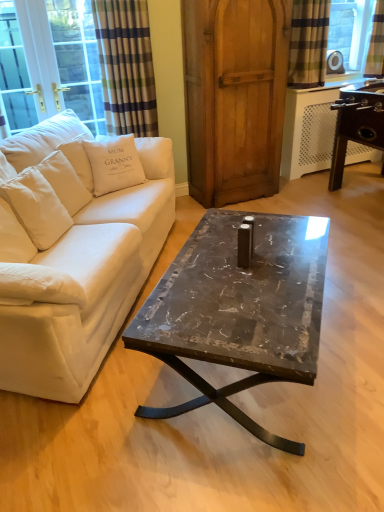
Describe the element at coordinates (74, 258) in the screenshot. I see `white fabric couch at left` at that location.

Describe the element at coordinates (126, 66) in the screenshot. I see `plaid fabric curtain at upper left, the third curtain positioned from the right` at that location.

Identify the location of white fabric cushion at left. (49, 63).

From a real-world perspective, is plaid fabric curtain at upper right, positioned as the first curtain in right-to-left order, positioned above or below wooden armoire at center?

plaid fabric curtain at upper right, positioned as the first curtain in right-to-left order, is situated higher than wooden armoire at center in the real world.

Measure the distance from plaid fabric curtain at upper right, positioned as the first curtain in right-to-left order, to wooden armoire at center.

A distance of 5.06 feet exists between plaid fabric curtain at upper right, positioned as the first curtain in right-to-left order, and wooden armoire at center.

From the image's perspective, is plaid fabric curtain at upper right, positioned as the first curtain in right-to-left order, located above wooden armoire at center?

Yes.

Which is less distant, (378, 71) or (222, 94)?

Point (378, 71) is positioned farther from the camera compared to point (222, 94).

Is white cotton pillow at upper left surrounding wooden armoire at center?

Actually, wooden armoire at center is outside white cotton pillow at upper left.

Looking at this image, based on their sizes in the image, would you say white cotton pillow at upper left is bigger or smaller than wooden armoire at center?

white cotton pillow at upper left is smaller than wooden armoire at center.

Considering the sizes of white cotton pillow at upper left and wooden armoire at center in the image, is white cotton pillow at upper left taller or shorter than wooden armoire at center?

white cotton pillow at upper left is shorter than wooden armoire at center.

Is plaid fabric curtain at upper right, which is the 3th curtain in left-to-right order, oriented towards plaid fabric curtain at upper right, which is the 2th curtain in left-to-right order?

No.

Considering the positions of point (380, 28) and point (298, 24), is point (380, 28) closer or farther from the camera than point (298, 24)?

Point (380, 28) is farther from the camera than point (298, 24).

From the image's perspective, between plaid fabric curtain at upper right, which is the 3th curtain in left-to-right order, and plaid fabric curtain at upper right, which is the 2th curtain in left-to-right order, which one is located above?

plaid fabric curtain at upper right, which is the 3th curtain in left-to-right order, from the image's perspective.

Considering the relative sizes of plaid fabric curtain at upper right, positioned as the first curtain in right-to-left order, and plaid fabric curtain at upper right, marked as the 2th curtain in a right-to-left arrangement, in the image provided, is plaid fabric curtain at upper right, positioned as the first curtain in right-to-left order, thinner than plaid fabric curtain at upper right, marked as the 2th curtain in a right-to-left arrangement,?

Correct, the width of plaid fabric curtain at upper right, positioned as the first curtain in right-to-left order, is less than that of plaid fabric curtain at upper right, marked as the 2th curtain in a right-to-left arrangement.

Measure the distance between plaid fabric curtain at upper right, which is the 3th curtain in left-to-right order, and marble-coated coffee table at center.

A: A distance of 3.07 meters exists between plaid fabric curtain at upper right, which is the 3th curtain in left-to-right order, and marble-coated coffee table at center.

Which is more to the left, plaid fabric curtain at upper right, positioned as the first curtain in right-to-left order, or marble-coated coffee table at center?

Positioned to the left is marble-coated coffee table at center.

Locate an element on the screen. the 3rd curtain above when counting from the marble-coated coffee table at center (from the image's perspective) is located at coordinates (376, 42).

Is marble-coated coffee table at center positioned far away from plaid fabric curtain at upper right, marked as the 2th curtain in a right-to-left arrangement?

Yes.

From a real-world perspective, between marble-coated coffee table at center and plaid fabric curtain at upper right, which is the 2th curtain in left-to-right order, who is vertically lower?

marble-coated coffee table at center is physically lower.

Considering the points (266, 292) and (303, 48), which point is in front, point (266, 292) or point (303, 48)?

The point (266, 292) is in front.

Is plaid fabric curtain at upper right, which is the 2th curtain in left-to-right order, at the back of marble-coated coffee table at center?

marble-coated coffee table at center does not have its back to plaid fabric curtain at upper right, which is the 2th curtain in left-to-right order.

Would you say white fabric couch at left is outside white fabric cushion at left?

Indeed, white fabric couch at left is completely outside white fabric cushion at left.

Locate an element on the screen. Image resolution: width=384 pixels, height=512 pixels. studio couch that is on the right side of white fabric cushion at left is located at coordinates (74, 258).

Is white fabric couch at left facing towards white fabric cushion at left?

No, white fabric couch at left is not facing towards white fabric cushion at left.

Considering the sizes of white fabric couch at left and white fabric cushion at left in the image, is white fabric couch at left bigger or smaller than white fabric cushion at left?

Clearly, white fabric couch at left is larger in size than white fabric cushion at left.

From a real-world perspective, who is located lower, white fabric cushion at left or plaid fabric curtain at upper right, which is the 2th curtain in left-to-right order?

Answer: white fabric cushion at left is physically lower.

How different are the orientations of white fabric cushion at left and plaid fabric curtain at upper right, marked as the 2th curtain in a right-to-left arrangement, in degrees?

There is a 6.24-degree angle between the facing directions of white fabric cushion at left and plaid fabric curtain at upper right, marked as the 2th curtain in a right-to-left arrangement.

Is white fabric cushion at left bigger than plaid fabric curtain at upper right, marked as the 2th curtain in a right-to-left arrangement?

Yes, white fabric cushion at left is bigger than plaid fabric curtain at upper right, marked as the 2th curtain in a right-to-left arrangement.

Where is `the 2nd curtain counting from the right side of the wooden armoire at center`? the 2nd curtain counting from the right side of the wooden armoire at center is located at coordinates (376, 42).

At what (x,y) coordinates should I click in order to perform the action: click on pillow directly beneath the wooden armoire at center (from a real-world perspective). Please return your answer as a coordinate pair (x, y). The width and height of the screenshot is (384, 512). Looking at the image, I should click on (114, 163).

Considering their positions, is plaid fabric curtain at upper right, which is the 2th curtain in left-to-right order, positioned further to white cotton pillow at upper left than white fabric couch at left?

Among the two, plaid fabric curtain at upper right, which is the 2th curtain in left-to-right order, is located further to white cotton pillow at upper left.

Considering their positions, is marble-coated coffee table at center positioned further to white fabric cushion at left than plaid fabric curtain at upper right, positioned as the first curtain in right-to-left order?

plaid fabric curtain at upper right, positioned as the first curtain in right-to-left order, is positioned further to the anchor white fabric cushion at left.

From the image, which object appears to be farther from white cotton pillow at upper left, white fabric cushion at left or plaid fabric curtain at upper left, the 1th curtain from the left?

Based on the image, white fabric cushion at left appears to be further to white cotton pillow at upper left.

Looking at the image, which one is located further to plaid fabric curtain at upper left, the 1th curtain from the left, marble-coated coffee table at center or white fabric couch at left?

marble-coated coffee table at center is further to plaid fabric curtain at upper left, the 1th curtain from the left.

Which object lies further to the anchor point white cotton pillow at upper left, marble-coated coffee table at center or plaid fabric curtain at upper right, marked as the 2th curtain in a right-to-left arrangement?

Among the two, plaid fabric curtain at upper right, marked as the 2th curtain in a right-to-left arrangement, is located further to white cotton pillow at upper left.

From the image, which object appears to be farther from plaid fabric curtain at upper right, which is the 3th curtain in left-to-right order, marble-coated coffee table at center or plaid fabric curtain at upper left, the third curtain positioned from the right?

marble-coated coffee table at center.

Looking at the image, which one is located further to plaid fabric curtain at upper right, which is the 3th curtain in left-to-right order, white cotton pillow at upper left or wooden armoire at center?

Among the two, white cotton pillow at upper left is located further to plaid fabric curtain at upper right, which is the 3th curtain in left-to-right order.

From the image, which object appears to be nearer to white fabric cushion at left, wooden armoire at center or white fabric couch at left?

white fabric couch at left.

Locate an element on the screen. window screen between white fabric couch at left and plaid fabric curtain at upper left, the third curtain positioned from the right, along the z-axis is located at coordinates (49, 63).

The width and height of the screenshot is (384, 512). Find the location of `armoire between plaid fabric curtain at upper left, the 1th curtain from the left, and plaid fabric curtain at upper right, which is the 2th curtain in left-to-right order, from left to right`. armoire between plaid fabric curtain at upper left, the 1th curtain from the left, and plaid fabric curtain at upper right, which is the 2th curtain in left-to-right order, from left to right is located at coordinates (234, 96).

At what (x,y) coordinates should I click in order to perform the action: click on armoire situated between white cotton pillow at upper left and plaid fabric curtain at upper right, marked as the 2th curtain in a right-to-left arrangement, from left to right. Please return your answer as a coordinate pair (x, y). Image resolution: width=384 pixels, height=512 pixels. Looking at the image, I should click on (234, 96).

Find the location of a particular element. curtain situated between white fabric cushion at left and plaid fabric curtain at upper right, marked as the 2th curtain in a right-to-left arrangement, from left to right is located at coordinates (126, 66).